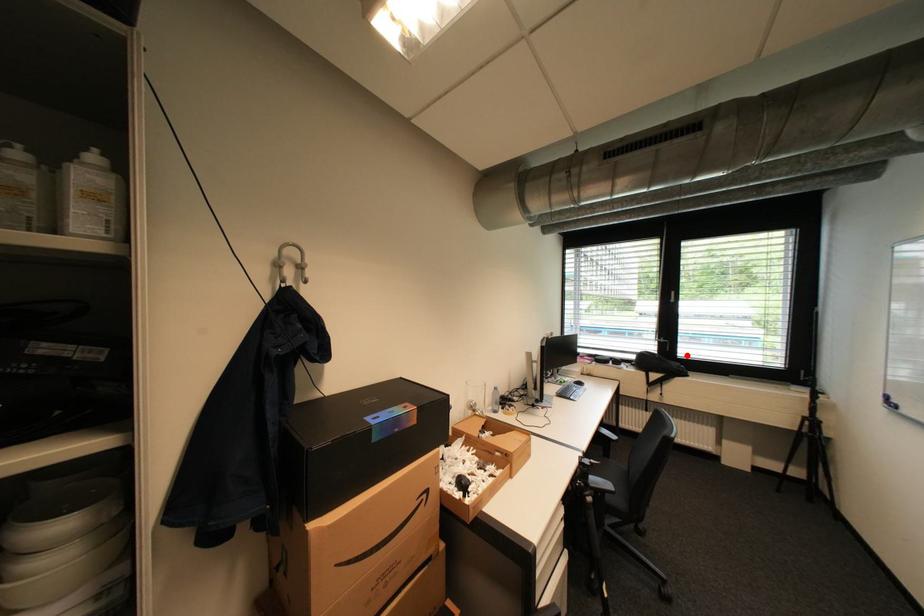
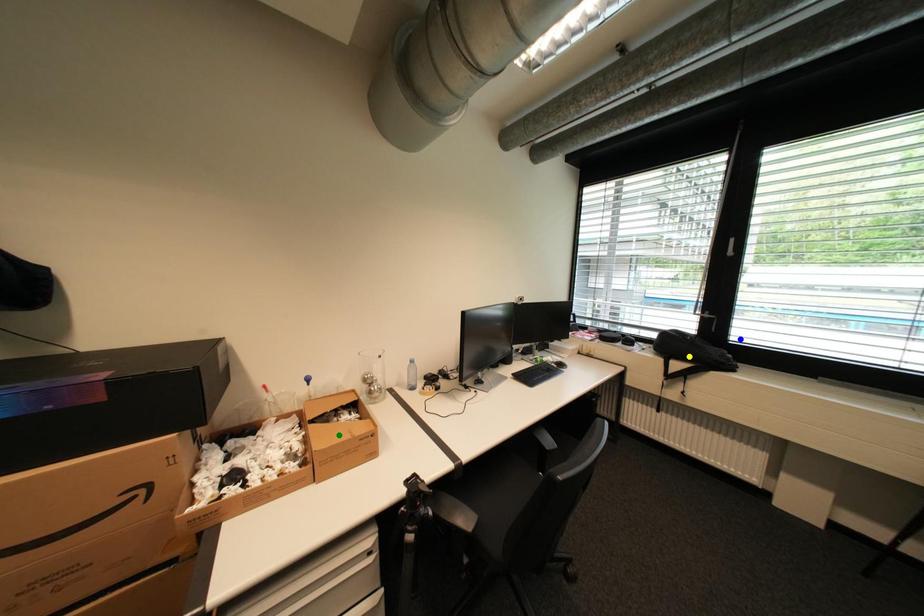
Question: I am providing you with two images of the same scene from different viewpoints. A red point is marked on the first image. You are given multiple points on the second image. Which point in image 2 represents the same 3d spot as the red point in image 1?

Choices:
 (A) green point
 (B) yellow point
 (C) blue point

Answer: (C)